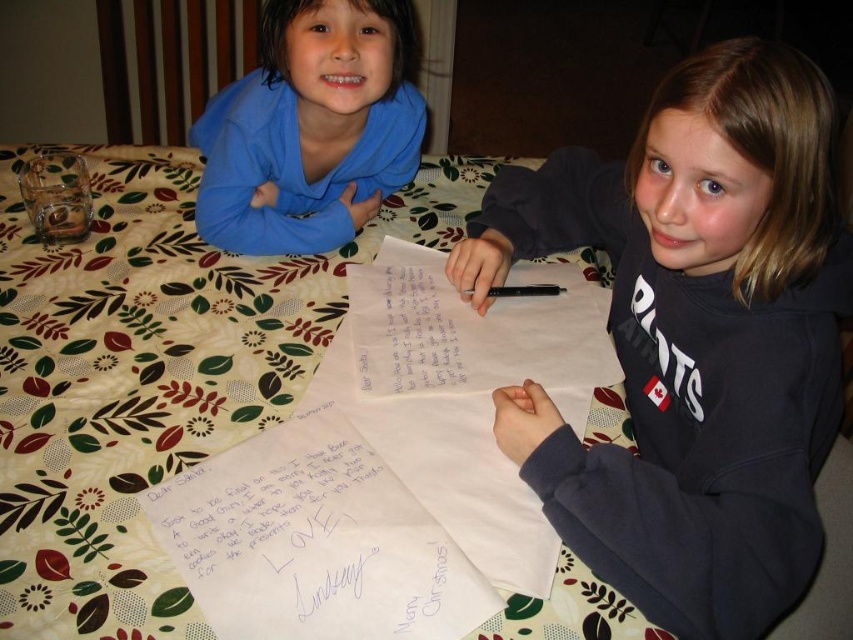
This screenshot has height=640, width=853. Describe the element at coordinates (314, 541) in the screenshot. I see `white paper at center` at that location.

Is point (305, 596) positioned in front of point (524, 291)?

That is True.

This screenshot has height=640, width=853. Identify the location of white paper at center. (314, 541).

Is floral fabric table at center to the left of white paper at center from the viewer's perspective?

Yes, floral fabric table at center is to the left of white paper at center.

Is floral fabric table at center shorter than white paper at center?

No.

Image resolution: width=853 pixels, height=640 pixels. Describe the element at coordinates (149, 374) in the screenshot. I see `floral fabric table at center` at that location.

Where is `floral fabric table at center`? The width and height of the screenshot is (853, 640). floral fabric table at center is located at coordinates (149, 374).

Can you confirm if white paper at center is shorter than matte blue hoodie at upper left?

Yes, white paper at center is shorter than matte blue hoodie at upper left.

What do you see at coordinates (314, 541) in the screenshot?
I see `white paper at center` at bounding box center [314, 541].

Identify the location of white paper at center. This screenshot has height=640, width=853. pos(314,541).